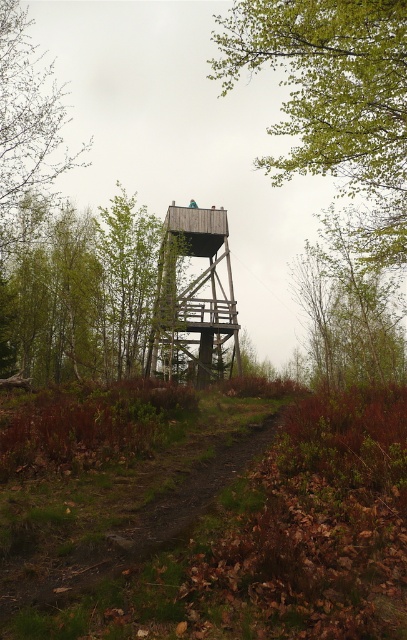
Question: Considering the real-world distances, which object is farthest from the green leafy tree at upper center?

Choices:
 (A) wooden platform at center
 (B) brown dirt path at center

Answer: (B)

Question: Can you confirm if brown dirt path at center is positioned to the left of wooden platform at center?

Choices:
 (A) no
 (B) yes

Answer: (A)

Question: Can you confirm if green leafy tree at upper center is smaller than wooden platform at center?

Choices:
 (A) yes
 (B) no

Answer: (B)

Question: Which point is farther from the camera taking this photo?

Choices:
 (A) (227, 240)
 (B) (63, 516)
 (C) (378, 193)

Answer: (A)

Question: Considering the real-world distances, which object is closest to the wooden platform at center?

Choices:
 (A) brown dirt path at center
 (B) green leafy tree at upper center

Answer: (B)

Question: Does green leafy tree at upper center lie behind brown dirt path at center?

Choices:
 (A) yes
 (B) no

Answer: (A)